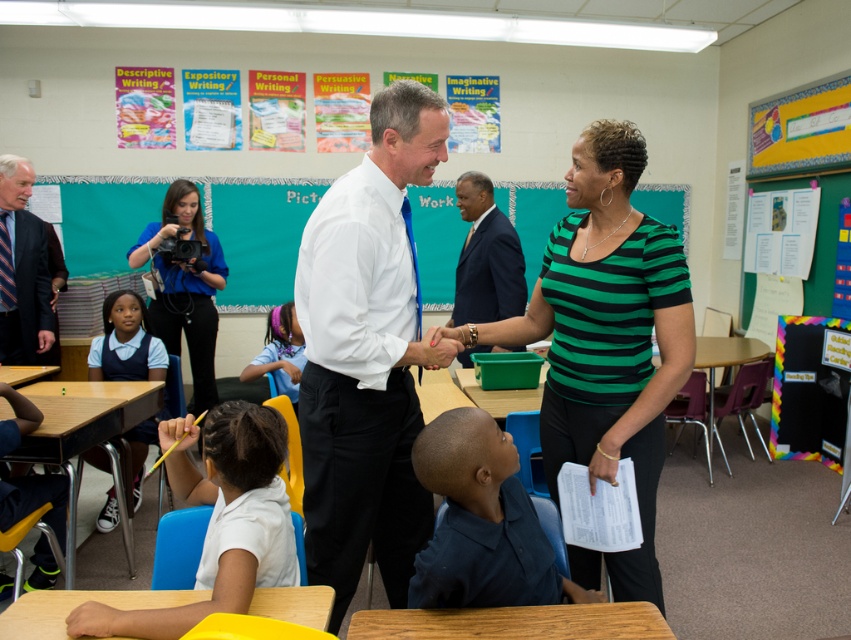
Can you confirm if dark blue shirt at lower center is smaller than dark blue suit at center?

Indeed, dark blue shirt at lower center has a smaller size compared to dark blue suit at center.

From the picture: Which is more to the right, dark blue shirt at lower center or dark blue suit at center?

dark blue suit at center

Locate an element on the screen. dark blue shirt at lower center is located at coordinates (481, 522).

Between dark blue suit at left and dark blue suit at center, which one is positioned lower?

A: dark blue suit at center

Can you confirm if dark blue suit at left is positioned to the right of dark blue suit at center?

No, dark blue suit at left is not to the right of dark blue suit at center.

Between point (16, 214) and point (497, 232), which one is positioned in front?

Point (497, 232) is in front.

The image size is (851, 640). Find the location of `dark blue suit at left`. dark blue suit at left is located at coordinates (21, 272).

Between point (235, 525) and point (193, 211), which one is positioned in front?

Point (235, 525)

Image resolution: width=851 pixels, height=640 pixels. I want to click on white paper at lower left, so click(218, 520).

At what (x,y) coordinates should I click in order to perform the action: click on white paper at lower left. Please return your answer as a coordinate pair (x, y). The height and width of the screenshot is (640, 851). Looking at the image, I should click on (218, 520).